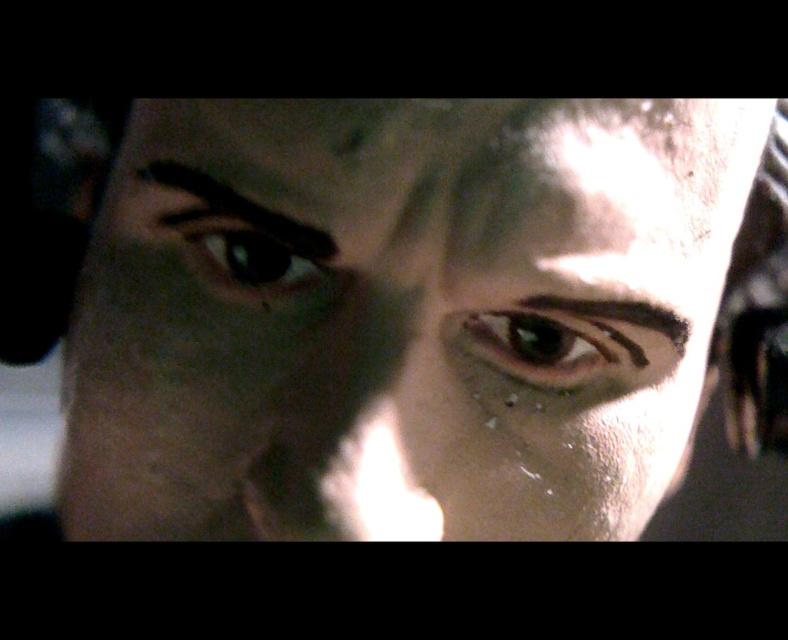
Does point (190, 220) come behind point (279, 228)?

Yes, it is behind point (279, 228).

Is point (227, 220) farther from viewer compared to point (240, 196)?

Yes, it is behind point (240, 196).

Where is `black glossy eye at upper left`? The height and width of the screenshot is (640, 788). black glossy eye at upper left is located at coordinates (244, 256).

Does point (712, 237) lie in front of point (668, 326)?

That is False.

Can you confirm if smooth skin forehead at center is thinner than brown matte eyebrow at center?

Incorrect, smooth skin forehead at center's width is not less than brown matte eyebrow at center's.

The width and height of the screenshot is (788, 640). Find the location of `smooth skin forehead at center`. smooth skin forehead at center is located at coordinates (439, 172).

You are a GUI agent. You are given a task and a screenshot of the screen. Output one action in this format:
    pyautogui.click(x=<x>, y=<y>)
    Task: Click on the smooth skin forehead at center
    This screenshot has height=640, width=788.
    Given the screenshot: What is the action you would take?
    pyautogui.click(x=439, y=172)

Describe the element at coordinates (402, 314) in the screenshot. I see `slick skin face at center` at that location.

Between slick skin face at center and brown matte eye at center, which one appears on the left side from the viewer's perspective?

slick skin face at center

Who is more distant from viewer, (305, 301) or (485, 340)?

The point (485, 340) is behind.

Where is `slick skin face at center`? This screenshot has width=788, height=640. slick skin face at center is located at coordinates (402, 314).